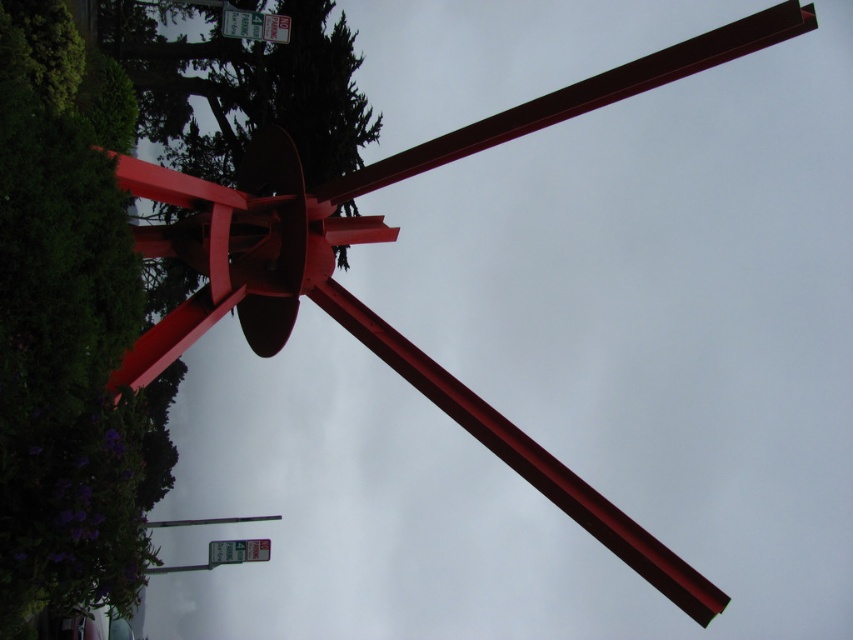
You are standing in front of the red metal sculpture and notice a point marked at coordinates (x=67, y=326). Based on the scene description, can you determine what this point is located on?

The point at coordinates (x=67, y=326) is located on the green leafy tree at upper left.

You are standing in front of the red metal sculpture and notice the green leafy tree at upper left and the white plastic sign at upper left. Which object is closer to you?

The green leafy tree at upper left is closer to you because it is in front of the white plastic sign at upper left.